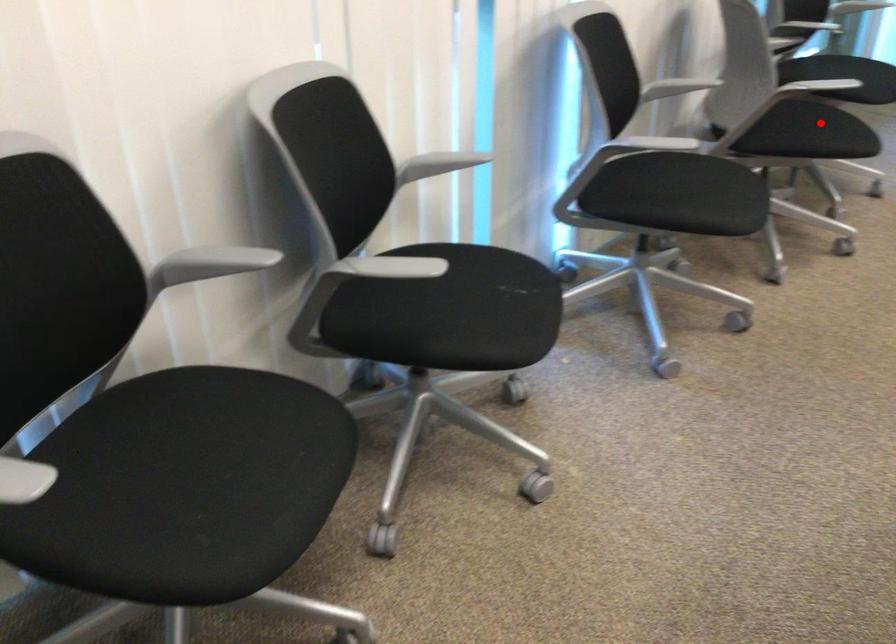
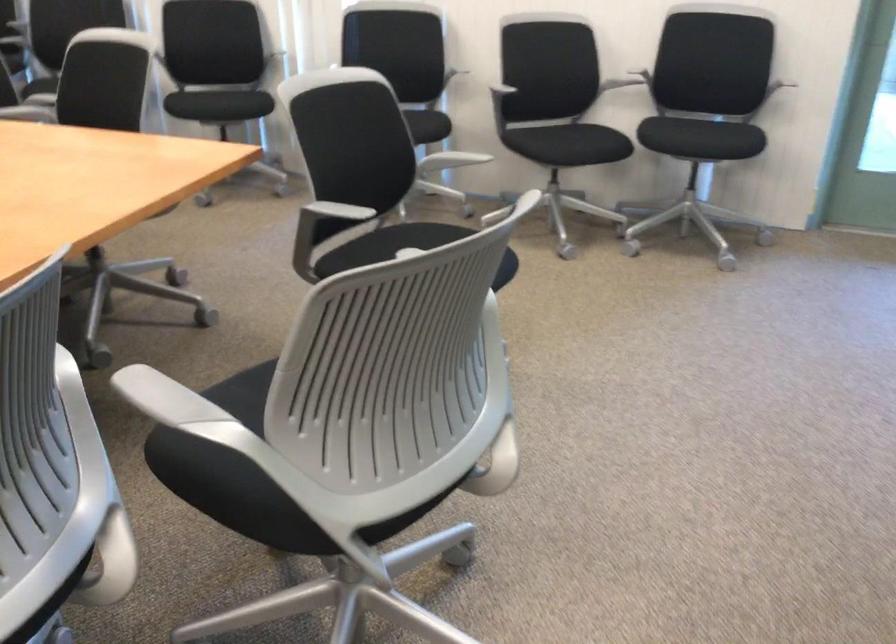
Find the pixel in the second image that matches the highlighted location in the first image.

(579, 144)